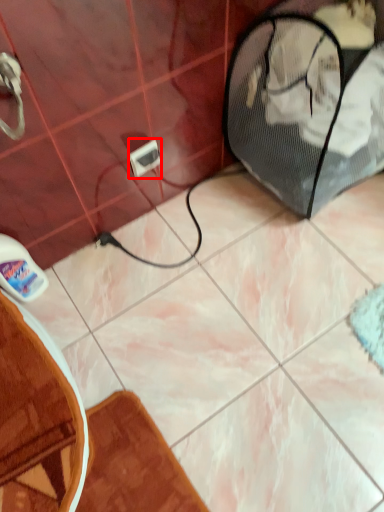
Question: From the image's perspective, what is the correct spatial relationship of electric outlet (annotated by the red box) in relation to bath mat?

Choices:
 (A) above
 (B) below

Answer: (A)